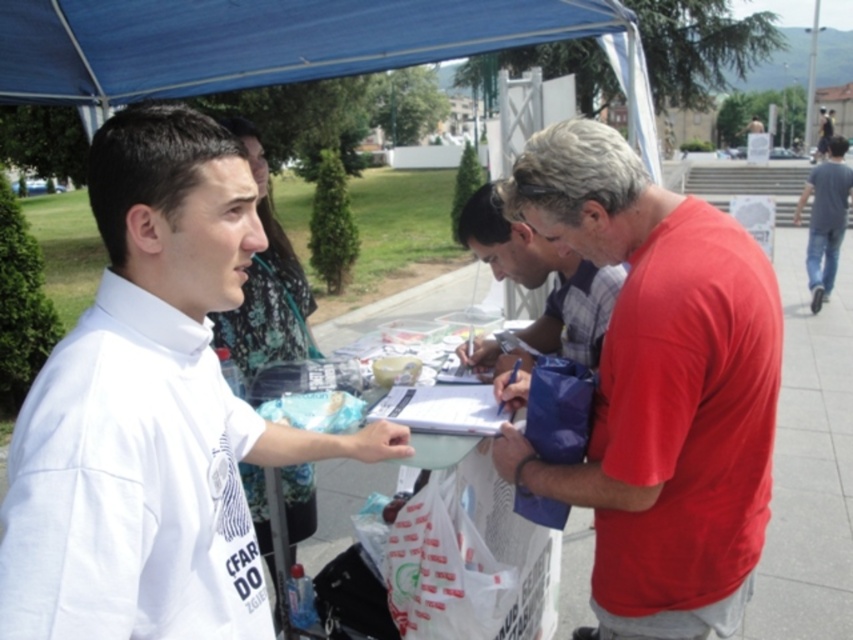
You are standing at the center of the blue canopy tent and want to take a photo of both the point at coordinates point (749, 294) and point (567, 291). Which point should you focus on first to ensure both are in focus?

You should focus on point (749, 294) first because it is closer to the camera than point (567, 291). By focusing on the closer point, the farther point will also be in focus due to the depth of field.

You are a photographer taking a picture of the two people at the center of the scene. The white cotton shirt at center and the matte red shirt at center are both in your frame. If you want to ensure both shirts are clearly visible, which shirt should you focus on first to account for their sizes?

The white cotton shirt at center has a greater height compared to matte red shirt at center, so you should focus on the white cotton shirt at center first since it is larger and may require more precise focus to ensure clarity.